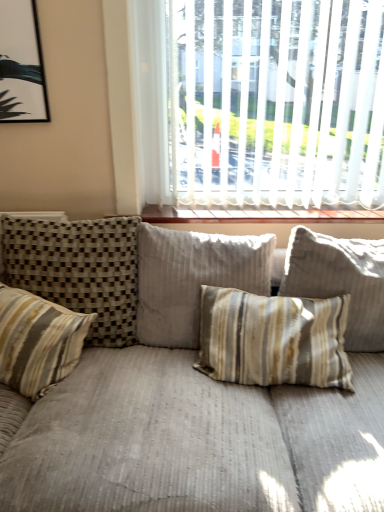
Question: Are striped fabric pillow at center, the 1th pillow from the right, and wooden at upper center located far from each other?

Choices:
 (A) no
 (B) yes

Answer: (A)

Question: From the image's perspective, is striped fabric pillow at center, positioned as the 4th pillow in left-to-right order, below wooden at upper center?

Choices:
 (A) no
 (B) yes

Answer: (B)

Question: From a real-world perspective, is striped fabric pillow at center, positioned as the 4th pillow in left-to-right order, beneath wooden at upper center?

Choices:
 (A) yes
 (B) no

Answer: (A)

Question: Is striped fabric pillow at center, the 1th pillow from the right, positioned with its back to wooden at upper center?

Choices:
 (A) no
 (B) yes

Answer: (B)

Question: Is wooden at upper center inside striped fabric pillow at center, positioned as the 4th pillow in left-to-right order?

Choices:
 (A) no
 (B) yes

Answer: (A)

Question: From their relative heights in the image, would you say striped fabric pillow at center, the second pillow from the right, is taller or shorter than striped fabric pillow at left, arranged as the 1th pillow when viewed from the left?

Choices:
 (A) tall
 (B) short

Answer: (A)

Question: Is striped fabric pillow at center, the second pillow from the right, in front of or behind striped fabric pillow at left, which appears as the fourth pillow when viewed from the right, in the image?

Choices:
 (A) front
 (B) behind

Answer: (B)

Question: Considering the positions of striped fabric pillow at center, the second pillow from the right, and striped fabric pillow at left, arranged as the 1th pillow when viewed from the left, in the image, is striped fabric pillow at center, the second pillow from the right, bigger or smaller than striped fabric pillow at left, arranged as the 1th pillow when viewed from the left,?

Choices:
 (A) small
 (B) big

Answer: (B)

Question: From the image's perspective, is striped fabric pillow at center, the third pillow positioned from the left, above or below striped fabric pillow at left, arranged as the 1th pillow when viewed from the left?

Choices:
 (A) below
 (B) above

Answer: (B)

Question: From the image's perspective, is striped fabric pillow at center, the second pillow from the right, above or below striped fabric pillow at center, the 1th pillow from the right?

Choices:
 (A) below
 (B) above

Answer: (A)

Question: Considering the positions of striped fabric pillow at center, the second pillow from the right, and striped fabric pillow at center, the 1th pillow from the right, in the image, is striped fabric pillow at center, the second pillow from the right, wider or thinner than striped fabric pillow at center, the 1th pillow from the right,?

Choices:
 (A) wide
 (B) thin

Answer: (A)

Question: Visually, is striped fabric pillow at center, the third pillow positioned from the left, positioned to the left or to the right of striped fabric pillow at center, positioned as the 4th pillow in left-to-right order?

Choices:
 (A) left
 (B) right

Answer: (A)

Question: Is point (180, 256) closer or farther from the camera than point (359, 338)?

Choices:
 (A) closer
 (B) farther

Answer: (B)

Question: From the image's perspective, is striped fabric pillow at center, the 1th pillow from the right, located above or below white blinds at upper center?

Choices:
 (A) below
 (B) above

Answer: (A)

Question: Does point (324, 281) appear closer or farther from the camera than point (145, 96)?

Choices:
 (A) farther
 (B) closer

Answer: (B)